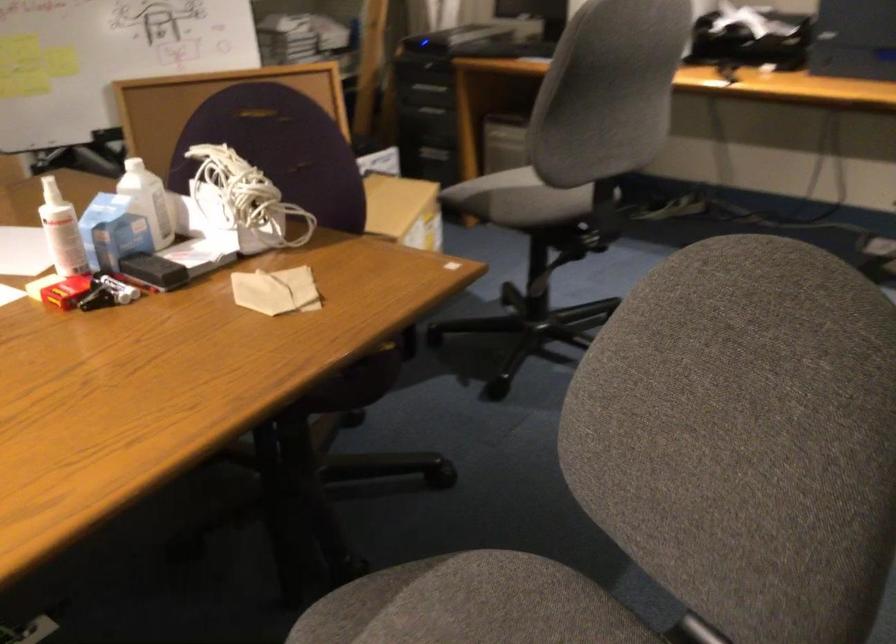
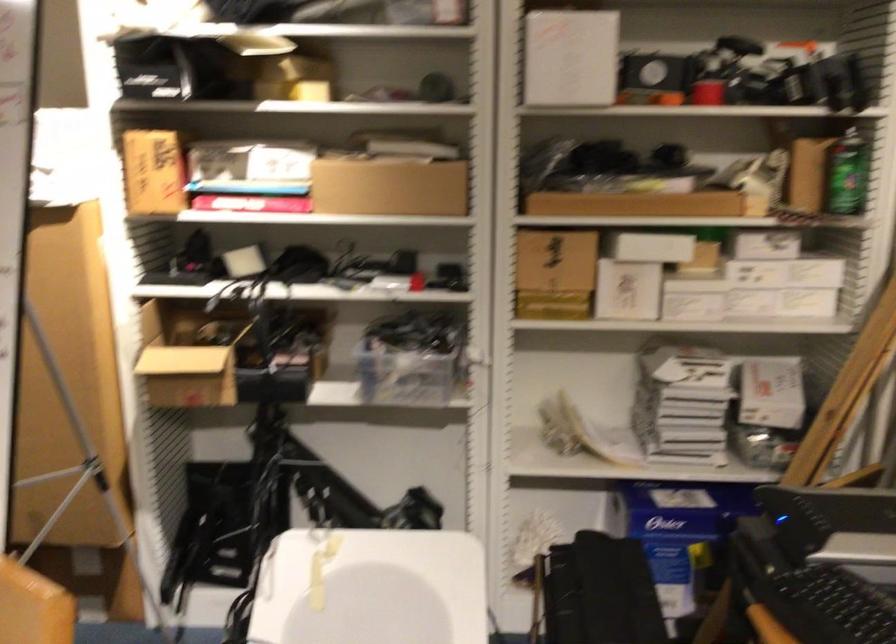
Where in the second image is the point corresponding to point 356,104 from the first image?

(683, 534)